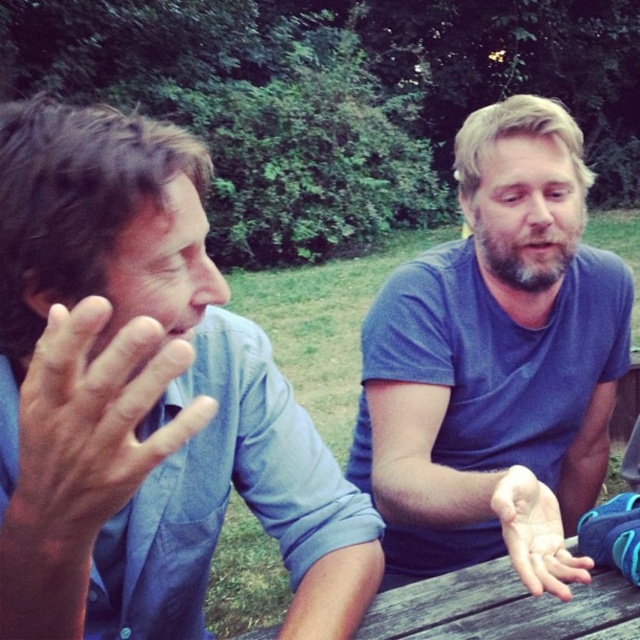
Question: Which is farther from the smooth skin hand at center?

Choices:
 (A) blue cotton shirt at left
 (B) blue cotton shirt at center
 (C) matte blue shirt at left

Answer: (C)

Question: Among these points, which one is nearest to the camera?

Choices:
 (A) (572, 378)
 (B) (524, 580)

Answer: (B)

Question: Is blue cotton shirt at left further to camera compared to blue cotton shirt at center?

Choices:
 (A) no
 (B) yes

Answer: (A)

Question: Which object is positioned closest to the smooth skin hand at center?

Choices:
 (A) matte blue shirt at left
 (B) blue cotton shirt at center

Answer: (B)

Question: Does blue cotton shirt at left have a greater width compared to blue cotton shirt at center?

Choices:
 (A) yes
 (B) no

Answer: (B)

Question: Is blue cotton shirt at left bigger than blue cotton shirt at center?

Choices:
 (A) yes
 (B) no

Answer: (B)